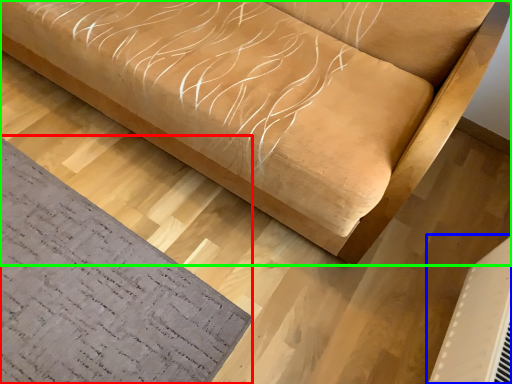
Question: Which is nearer to the mat (highlighted by a red box)? air conditioning (highlighted by a blue box) or furniture (highlighted by a green box).

Choices:
 (A) air conditioning
 (B) furniture

Answer: (B)